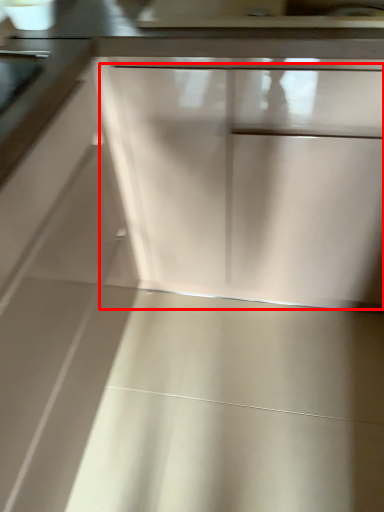
Question: From the image's perspective, considering the relative positions of drawer (annotated by the red box) and door handle in the image provided, where is drawer (annotated by the red box) located with respect to the staircase?

Choices:
 (A) above
 (B) below

Answer: (B)